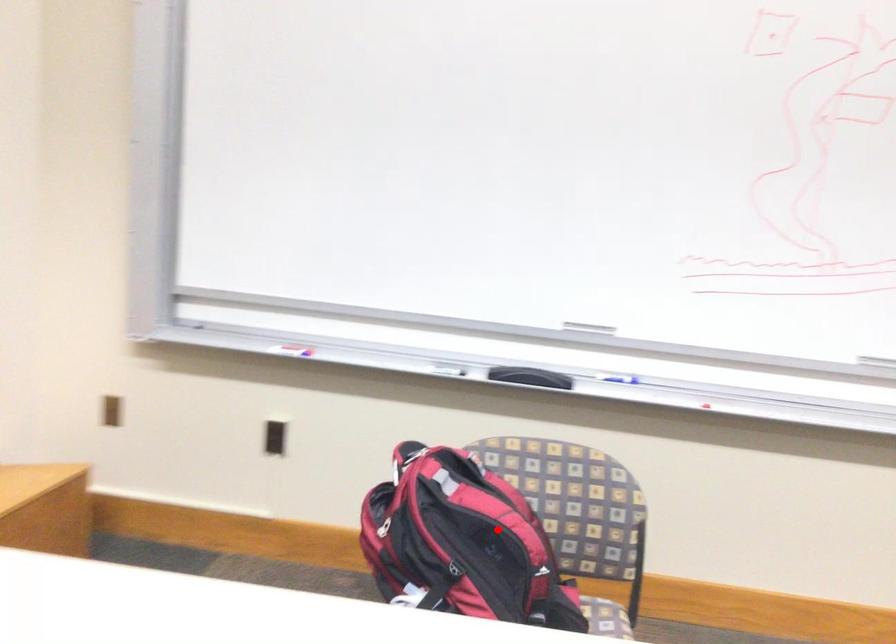
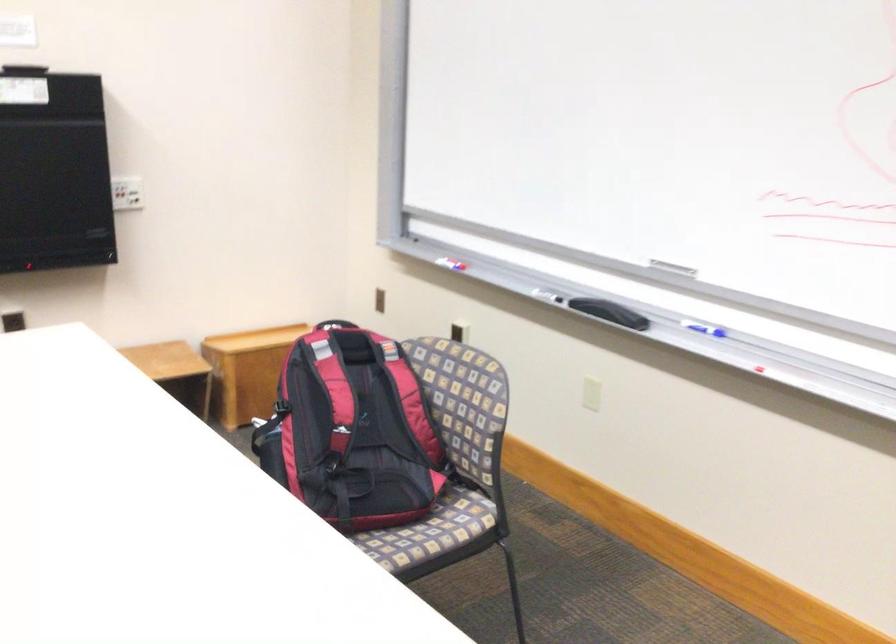
Locate, in the second image, the point that corresponds to the highlighted location in the first image.

(334, 391)